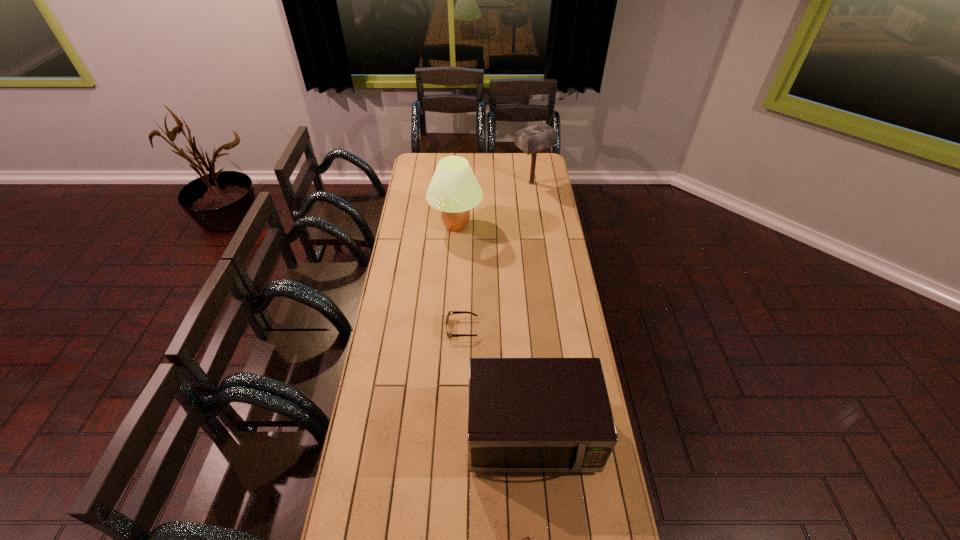
Image resolution: width=960 pixels, height=540 pixels. What are the coordinates of `empty space between the farthest object and the lampshade` in the screenshot? It's located at (494, 204).

Find the location of a particular element. the fourth closest object to the third tallest object is located at coordinates (532, 139).

Where is `the fourth closest object relative to the sunglasses`? This screenshot has height=540, width=960. the fourth closest object relative to the sunglasses is located at coordinates (532, 139).

Find the location of a particular element. vacant space that satisfies the following two spatial constraints: 1. on the front side of the farthest object; 2. on the shade of the second farthest object is located at coordinates (538, 226).

Locate an element on the screen. This screenshot has width=960, height=540. vacant space that satisfies the following two spatial constraints: 1. on the front side of the farthest object; 2. on the shade of the fourth nearest object is located at coordinates (538, 226).